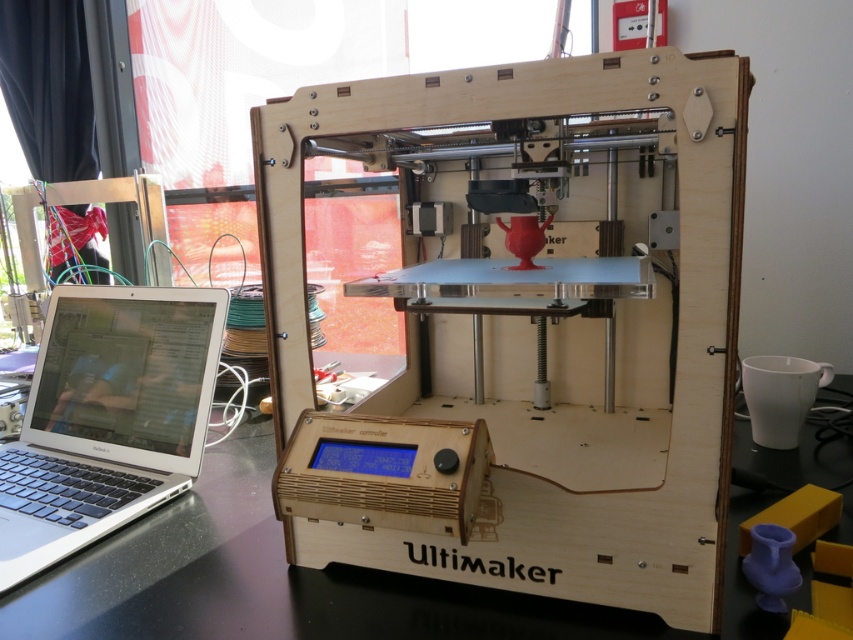
You are organizing your desk and want to place a new item between the black glossy table at lower left and the silver metallic laptop at left. Based on their positions, where should you place the new item?

Since the black glossy table at lower left is to the right of the silver metallic laptop at left, you should place the new item between them by positioning it to the right of the silver metallic laptop at left and to the left of the black glossy table at lower left.

You are standing in front of the desk and want to place a new 3D model file onto the laptop to the left of the wooden ultimaker 3d printer at center. Can you determine the direction you need to move to reach the laptop?

The wooden ultimaker 3d printer at center is located at point (525, 330). Since the laptop is to the left of the printer, you should move to the left to reach the laptop.

Looking at this image, you are standing in the workspace and want to place a heavy box on the surface closest to you. Which object should you choose between the wooden ultimaker 3d printer at center and the black glossy table at lower left?

The wooden ultimaker 3d printer at center is in front of the black glossy table at lower left, so the surface closest to you is the wooden ultimaker 3d printer at center. However, placing a heavy box on it might interfere with the printer. Consider using the black glossy table at lower left instead.